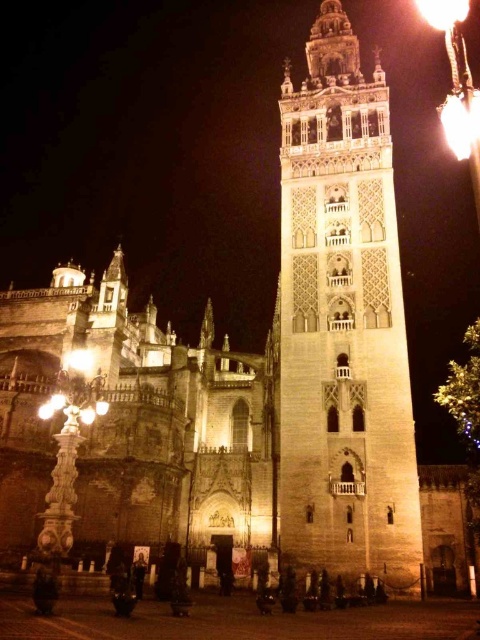
Is light beige stone bell tower at center shorter than bright yellow flame at upper right?

No, light beige stone bell tower at center is not shorter than bright yellow flame at upper right.

Does point (286, 230) lie behind point (451, 106)?

Yes, point (286, 230) is behind point (451, 106).

I want to click on light beige stone bell tower at center, so click(342, 324).